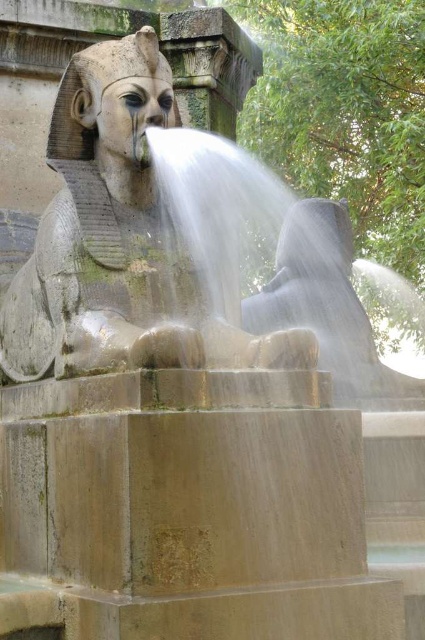
You are designing a protective barrier around the fountain to prevent visitors from getting too close to the stone statue at center and the clear water at sphinx center. The barrier needs to be placed at a distance that accommodates both objects. Which object requires the barrier to be placed further away to ensure it doesn not obstruct the view of either?

The clear water at sphinx center requires the barrier to be placed further away because it is wider than the stone statue at center, so to ensure both are visible without obstruction, the barrier must account for the larger width of the clear water at sphinx center.

You are a maintenance worker checking the fountain. You need to clean the stone statue at center and the clear water at sphinx center. Which object should you clean first if you want to avoid getting wet?

You should clean the stone statue at center first because it is positioned under the clear water at sphinx center, so cleaning the statue first would prevent water from dripping onto it afterward.

You are standing in front of the fountain and want to know if the stone statue at center is taller than the clear water at sphinx center. Based on the scene, what can you conclude?

The stone statue at center is not as tall as clear water at sphinx center, so the clear water at sphinx center is taller than the stone statue at center.